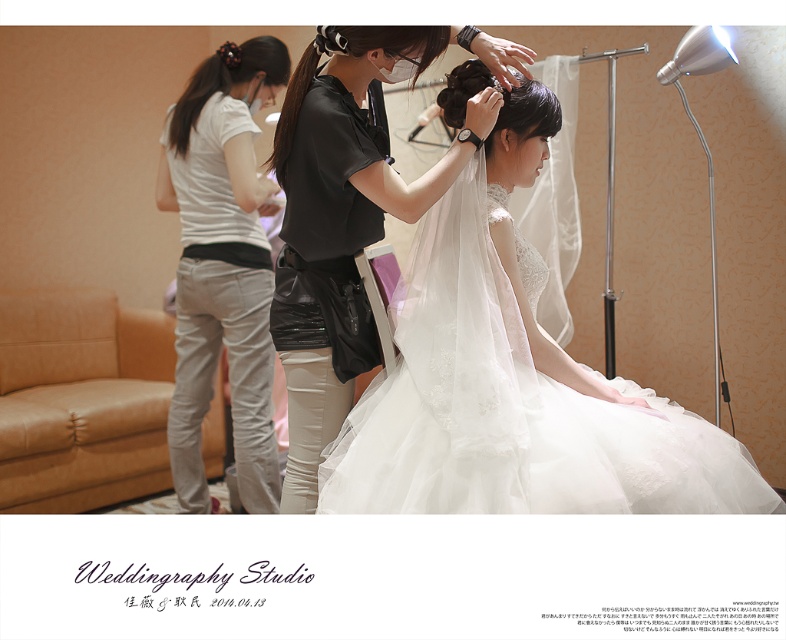
Question: Considering the real-world distances, which object is farthest from the white cotton shirt at center?

Choices:
 (A) matte black shirt at center
 (B) white lace dress at center
 (C) white lace veil at upper center

Answer: (B)

Question: Does black shiny hair at upper left have a smaller size compared to black glossy hair at center?

Choices:
 (A) yes
 (B) no

Answer: (A)

Question: Can you confirm if white lace dress at center is wider than black shiny hair at upper left?

Choices:
 (A) no
 (B) yes

Answer: (B)

Question: Which point is closer to the camera?

Choices:
 (A) (248, 120)
 (B) (369, 29)
 (C) (509, 92)

Answer: (B)

Question: Estimate the real-world distances between objects in this image. Which object is closer to the white lace dress at center?

Choices:
 (A) black shiny hair at upper left
 (B) white cotton shirt at center
 (C) matte black shirt at center
 (D) white lace veil at upper center

Answer: (C)

Question: Is white cotton shirt at center closer to the viewer compared to black glossy hair at center?

Choices:
 (A) yes
 (B) no

Answer: (B)